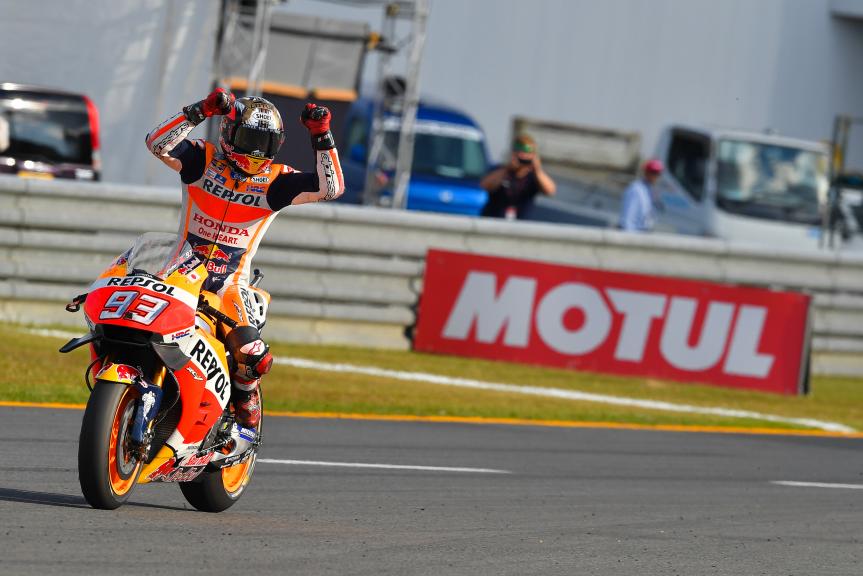
Identify the location of mirror. Image resolution: width=863 pixels, height=576 pixels. (152, 257).